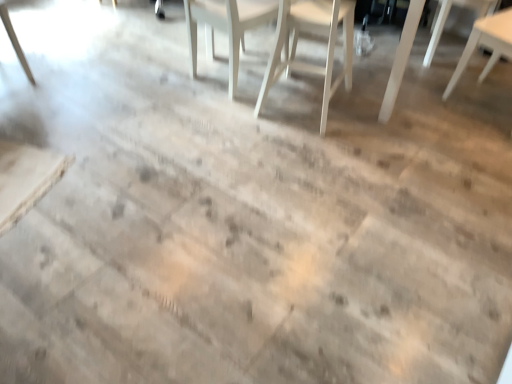
I want to click on free spot below white wood chair at center, which appears as the 2th chair when viewed from the left (from a real-world perspective), so click(x=292, y=103).